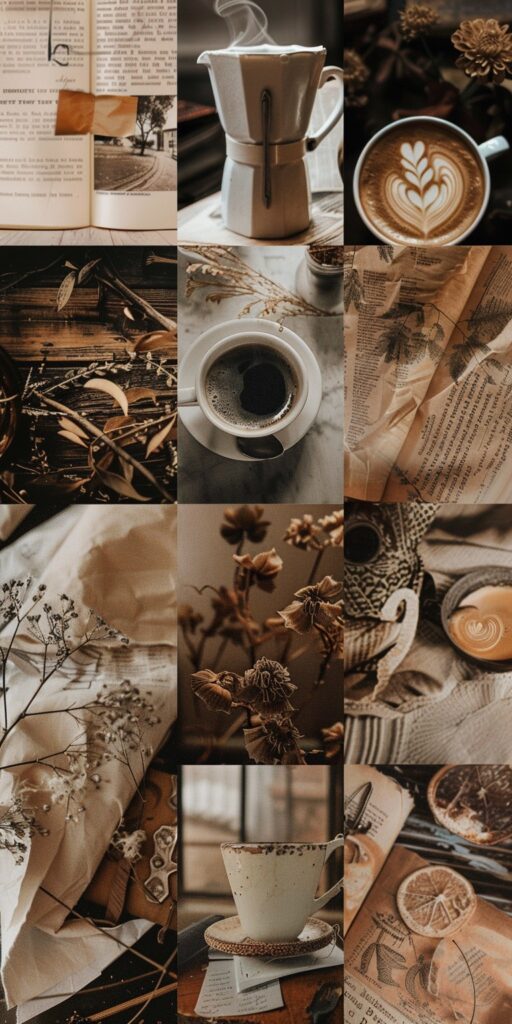
Where is `pictures with brown plants/flowers in them`? Image resolution: width=512 pixels, height=1024 pixels. pictures with brown plants/flowers in them is located at coordinates (42, 721), (201, 675), (256, 293), (96, 334), (422, 329), (473, 57).